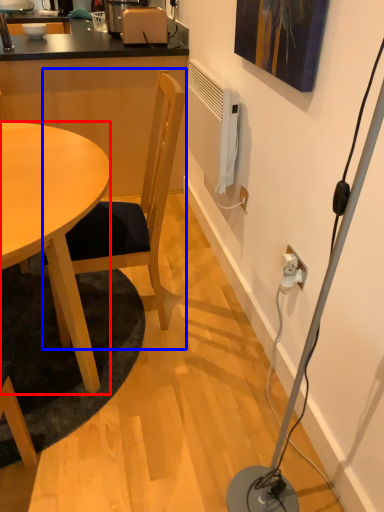
Question: Which of the following is the farthest to the observer, desk (highlighted by a red box) or chair (highlighted by a blue box)?

Choices:
 (A) desk
 (B) chair

Answer: (B)